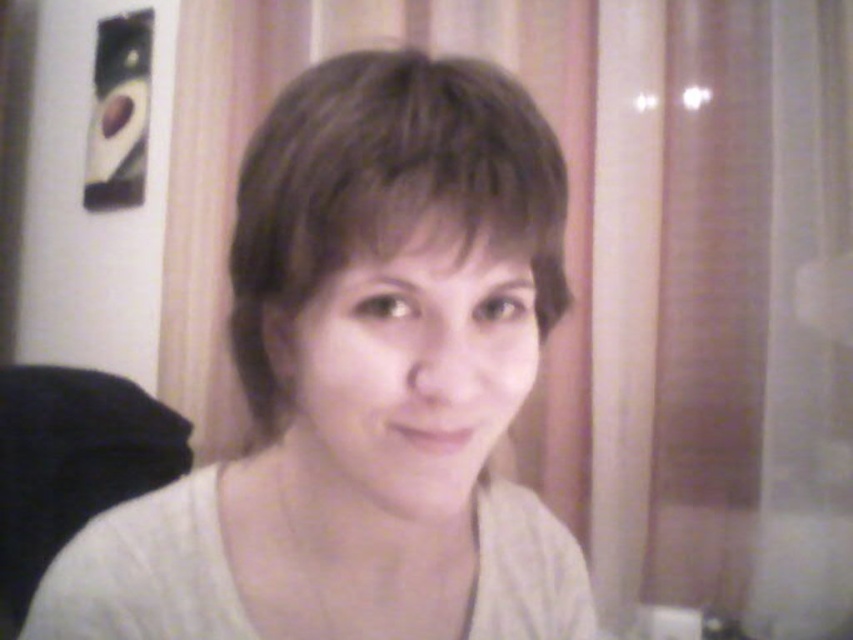
Based on the scene description, where is the white matte shirt at center located in terms of coordinates?

The white matte shirt at center is located at coordinates point (364, 385).

You are a photographer adjusting lighting for a portrait. You notice the white matte shirt at center and the brown matte hair at center. Which object is wider in the frame?

The white matte shirt at center is wider than the brown matte hair at center in the frame.

You are a photographer adjusting the lighting in the studio. You notice the white matte shirt at center and the brown matte hair at center. Which object should you focus on to ensure proper exposure since it is closer to the camera?

The white matte shirt at center is in front of the brown matte hair at center, so you should focus on the white matte shirt at center for proper exposure as it is closer to the camera.